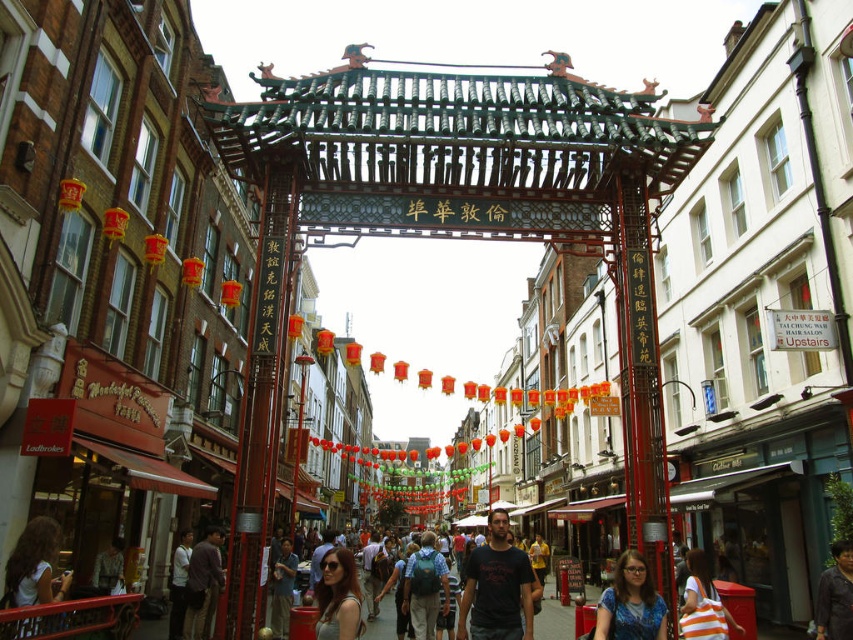
Measure the distance from orange striped bag at center to dark brown leather jacket at lower left.

160.02 feet

Which is more to the left, orange striped bag at center or dark brown leather jacket at lower left?

From the viewer's perspective, dark brown leather jacket at lower left appears more on the left side.

Locate an element on the screen. orange striped bag at center is located at coordinates (703, 604).

Who is higher up, dark blue t-shirt at center or dark brown leather jacket at lower left?

Positioned higher is dark blue t-shirt at center.

Is dark blue t-shirt at center thinner than dark brown leather jacket at lower left?

Incorrect, dark blue t-shirt at center's width is not less than dark brown leather jacket at lower left's.

Locate an element on the screen. dark blue t-shirt at center is located at coordinates pyautogui.click(x=496, y=586).

From the picture: Is dark blue t-shirt at center thinner than matte black shirt at lower center?

No, dark blue t-shirt at center is not thinner than matte black shirt at lower center.

Locate an element on the screen. dark blue t-shirt at center is located at coordinates (496, 586).

Identify the location of dark blue t-shirt at center. (496, 586).